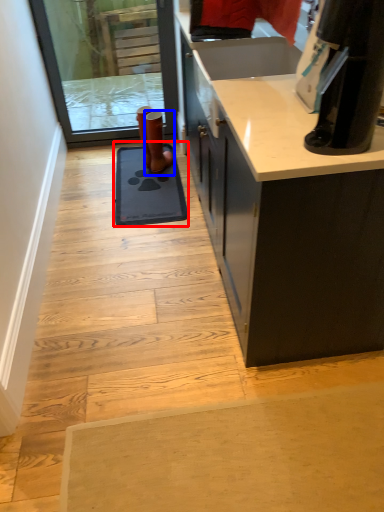
Question: Which point is further to the camera, doormat (highlighted by a red box) or footwear (highlighted by a blue box)?

Choices:
 (A) doormat
 (B) footwear

Answer: (B)